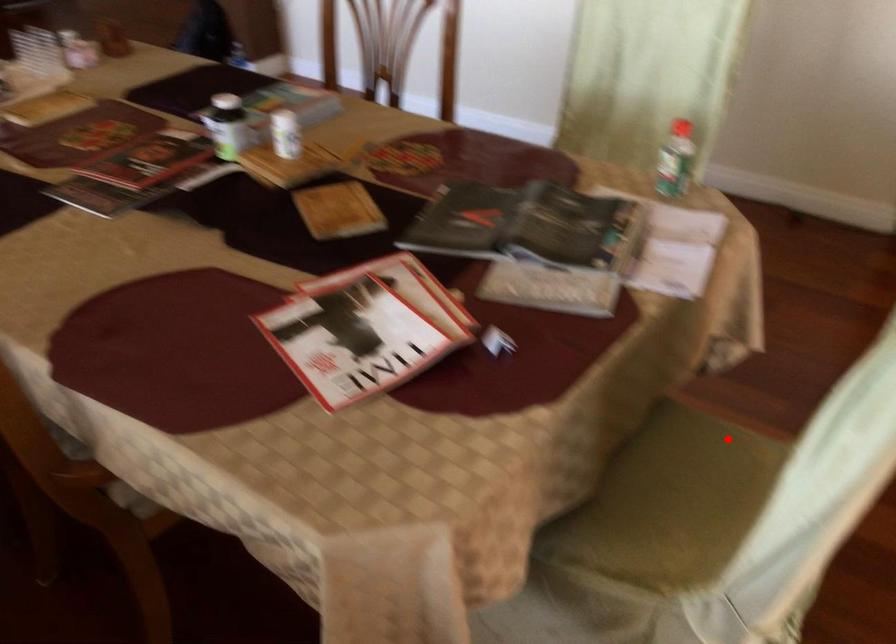
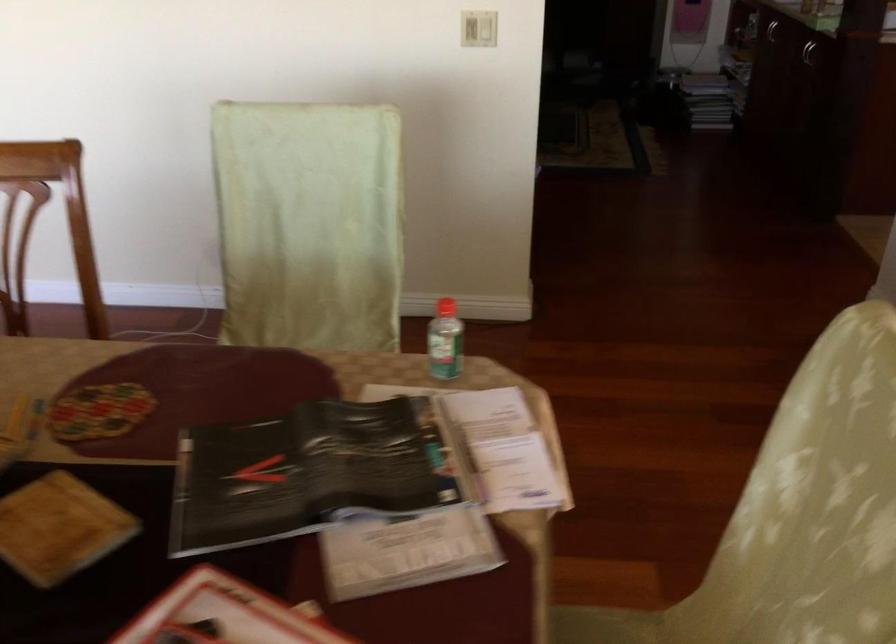
Find the pixel in the second image that matches the highlighted location in the first image.

(606, 626)